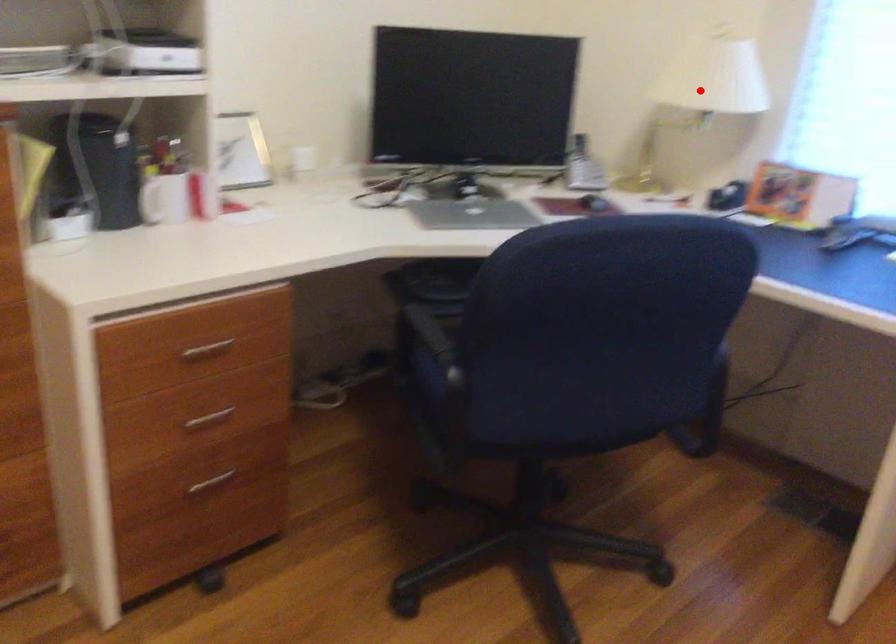
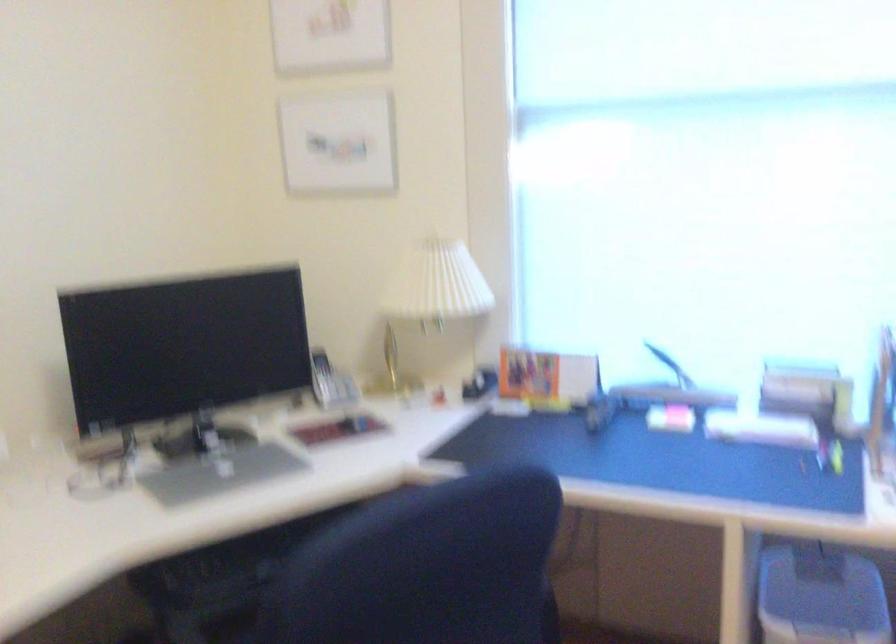
The point at the highlighted location is marked in the first image. Where is the corresponding point in the second image?

(433, 295)